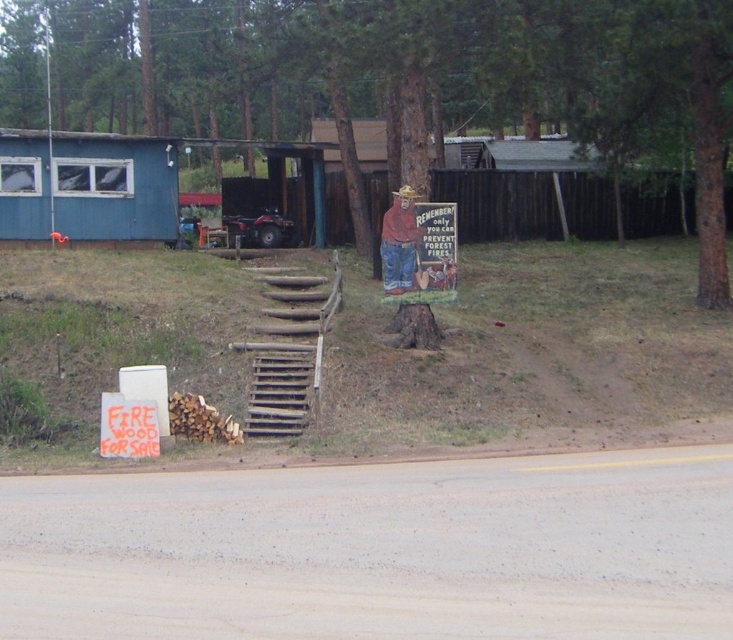
Question: Is brown wood tree stump at center bigger than blue wooden hut at left?

Choices:
 (A) yes
 (B) no

Answer: (A)

Question: Which of these objects is positioned farthest from the blue wooden hut at left?

Choices:
 (A) wooden stairs at center
 (B) orange wood sign at lower left

Answer: (B)

Question: Is blue wooden hut at left closer to the viewer compared to orange wood sign at lower left?

Choices:
 (A) no
 (B) yes

Answer: (A)

Question: Does brown wood tree stump at center appear on the left side of blue wooden hut at left?

Choices:
 (A) yes
 (B) no

Answer: (B)

Question: Which object appears closest to the camera in this image?

Choices:
 (A) brown wood tree stump at center
 (B) blue wooden hut at left

Answer: (A)

Question: Which point appears closest to the camera in this image?

Choices:
 (A) (578, 58)
 (B) (147, 419)
 (C) (21, 198)
 (D) (235, 349)

Answer: (B)